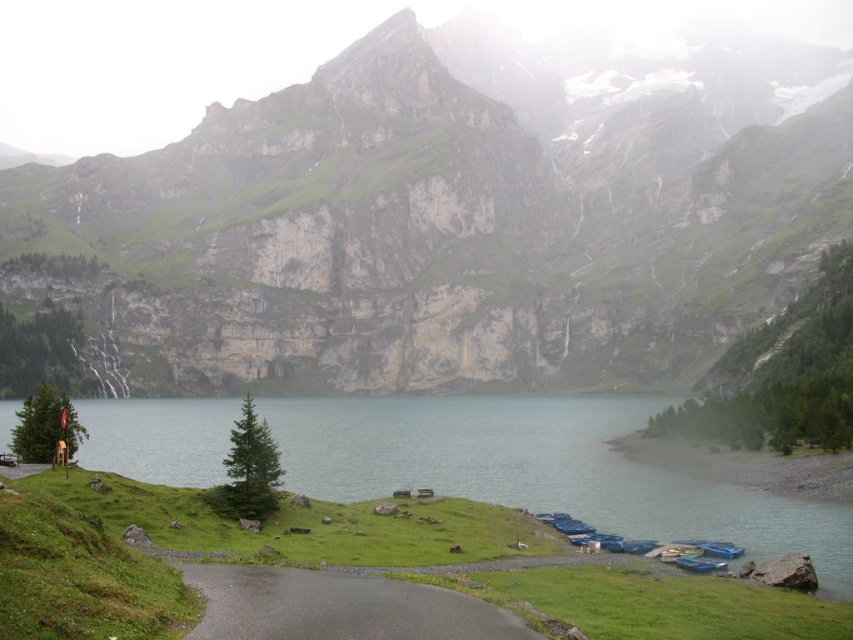
Question: Which of the following is the farthest from the observer?

Choices:
 (A) green rock at center
 (B) green grassy lake at lower center

Answer: (A)

Question: Can you confirm if green rock at center is positioned to the right of green grassy lake at lower center?

Choices:
 (A) no
 (B) yes

Answer: (B)

Question: Is green rock at center above green grassy lake at lower center?

Choices:
 (A) yes
 (B) no

Answer: (A)

Question: Among these points, which one is nearest to the camera?

Choices:
 (A) (123, 400)
 (B) (129, 364)

Answer: (A)

Question: Where is green rock at center located in relation to green grassy lake at lower center in the image?

Choices:
 (A) above
 (B) below

Answer: (A)